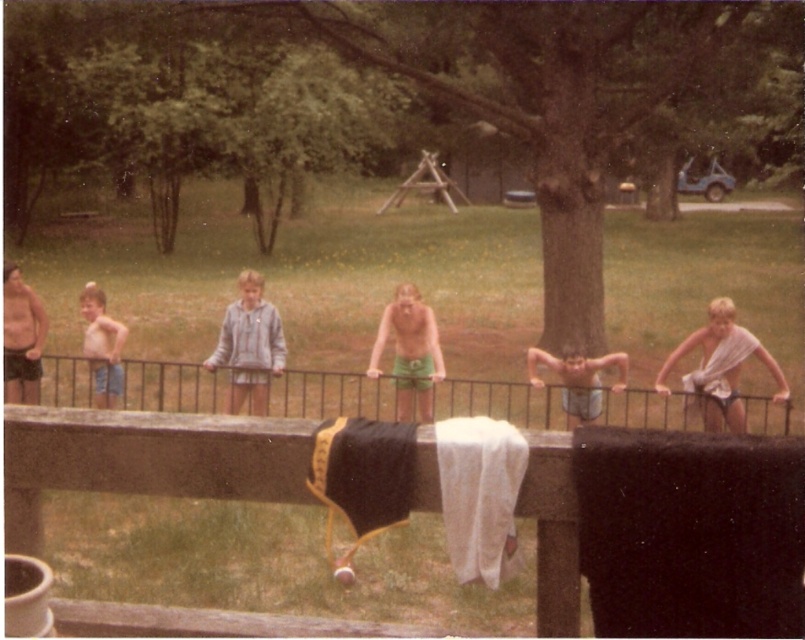
Does white cloth at right come in front of green cotton shorts at center?

No, it is behind green cotton shorts at center.

Between white cloth at right and green cotton shorts at center, which one is positioned higher?

green cotton shorts at center

Is point (733, 388) farther from camera compared to point (368, 365)?

That is False.

Identify the location of white cloth at right. (720, 368).

In the scene shown: Can you confirm if green cotton shorts at center is wider than light blue denim shorts at left?

Indeed, green cotton shorts at center has a greater width compared to light blue denim shorts at left.

Find the location of a particular element. Image resolution: width=805 pixels, height=640 pixels. green cotton shorts at center is located at coordinates click(x=409, y=353).

Between black iron fence at center and green cotton shorts at center, which one has less height?

black iron fence at center

Is point (436, 387) behind point (394, 337)?

Yes.

Locate an element on the screen. This screenshot has width=805, height=640. black iron fence at center is located at coordinates (329, 394).